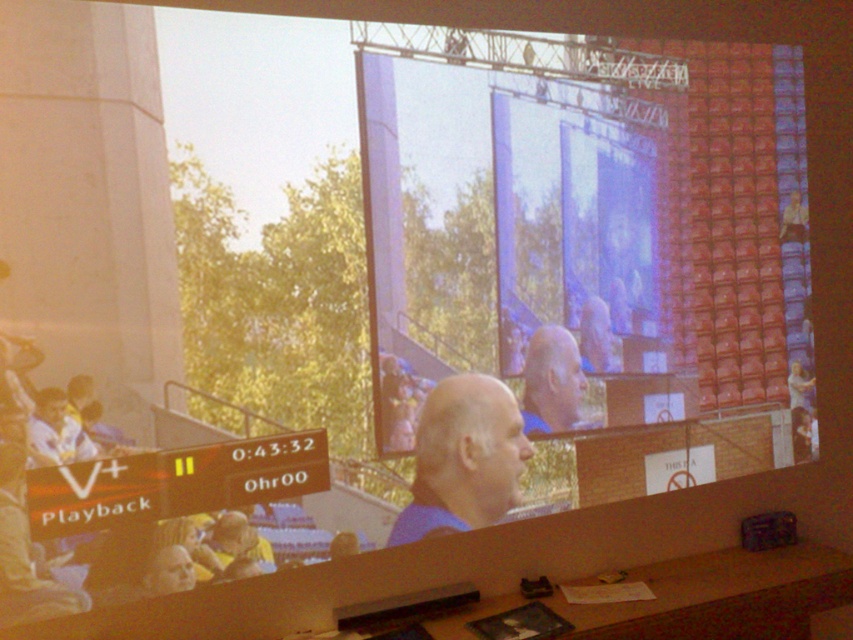
In the scene shown: Which is above, blue fabric shirt at center or smooth blue shirt at center?

Positioned higher is smooth blue shirt at center.

Find the location of a particular element. The height and width of the screenshot is (640, 853). blue fabric shirt at center is located at coordinates [463, 458].

This screenshot has width=853, height=640. I want to click on blue fabric shirt at center, so click(x=463, y=458).